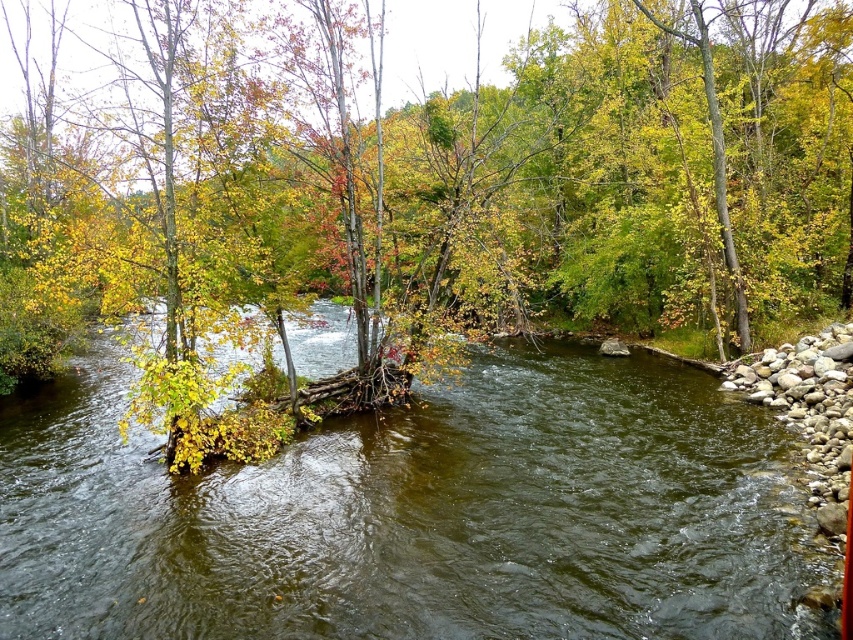
Is yellow-green leaves at center below greenish-brown water at center?

Incorrect, yellow-green leaves at center is not positioned below greenish-brown water at center.

Is yellow-green leaves at center taller than greenish-brown water at center?

Indeed, yellow-green leaves at center has a greater height compared to greenish-brown water at center.

Which is in front, point (738, 342) or point (242, 468)?

Point (242, 468) is more forward.

Identify the location of yellow-green leaves at center. Image resolution: width=853 pixels, height=640 pixels. (485, 179).